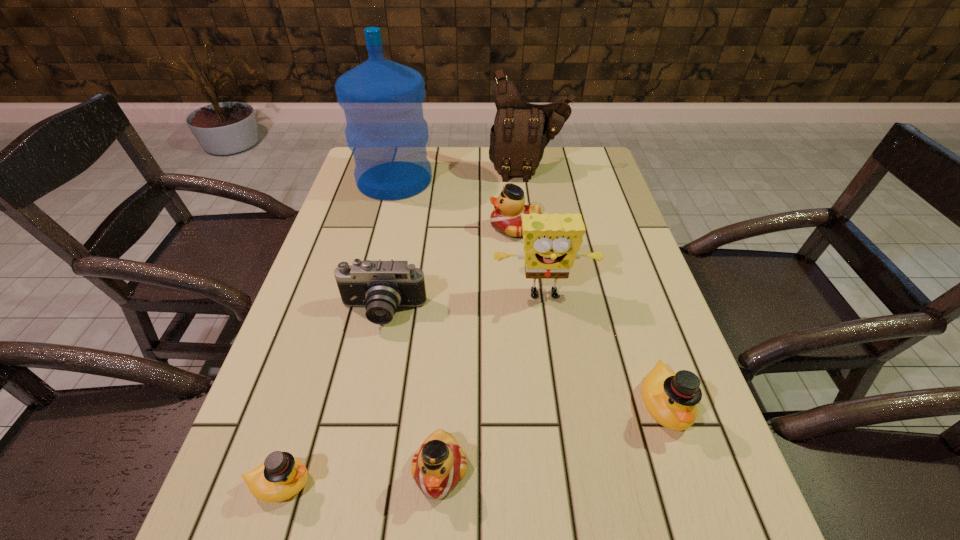
Where is `the tallest object`? The height and width of the screenshot is (540, 960). the tallest object is located at coordinates (382, 100).

You are a GUI agent. You are given a task and a screenshot of the screen. Output one action in this format:
    pyautogui.click(x=<x>, y=<y>)
    Task: Click on the blue water jug
    
    Given the screenshot: What is the action you would take?
    pyautogui.click(x=382, y=100)

Where is `shoulder bag`? shoulder bag is located at coordinates (521, 131).

Where is `the second tallest object`? This screenshot has height=540, width=960. the second tallest object is located at coordinates (521, 131).

Where is `the third tallest object`? The width and height of the screenshot is (960, 540). the third tallest object is located at coordinates (551, 242).

Identify the location of sponge. (551, 242).

The image size is (960, 540). Find the location of `the bigger red duck`. the bigger red duck is located at coordinates (506, 218).

Locate an element on the screen. This screenshot has height=540, width=960. the farthest duck is located at coordinates (506, 218).

What are the coordinates of `camera` in the screenshot? It's located at (381, 287).

Locate an element on the screen. The height and width of the screenshot is (540, 960). the rightmost object is located at coordinates (671, 398).